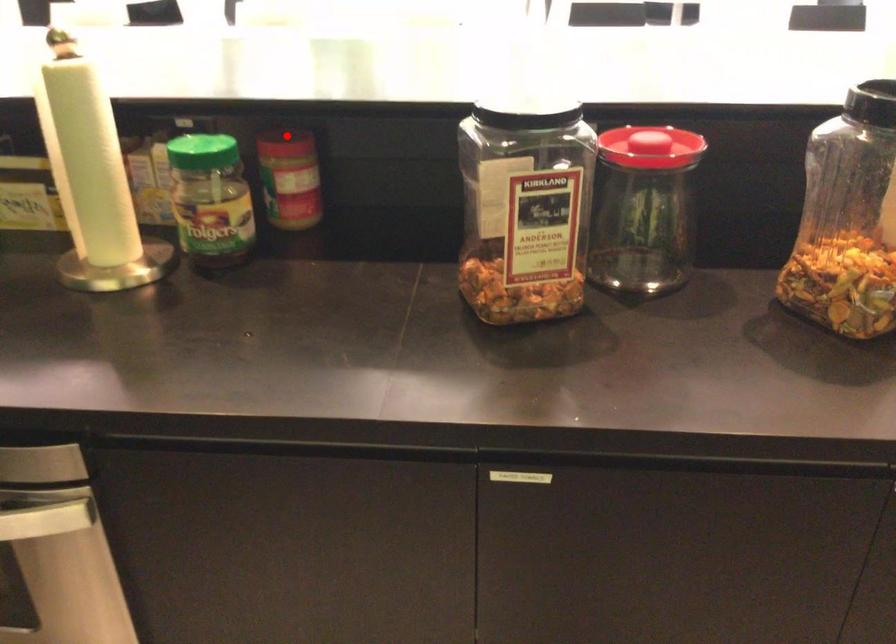
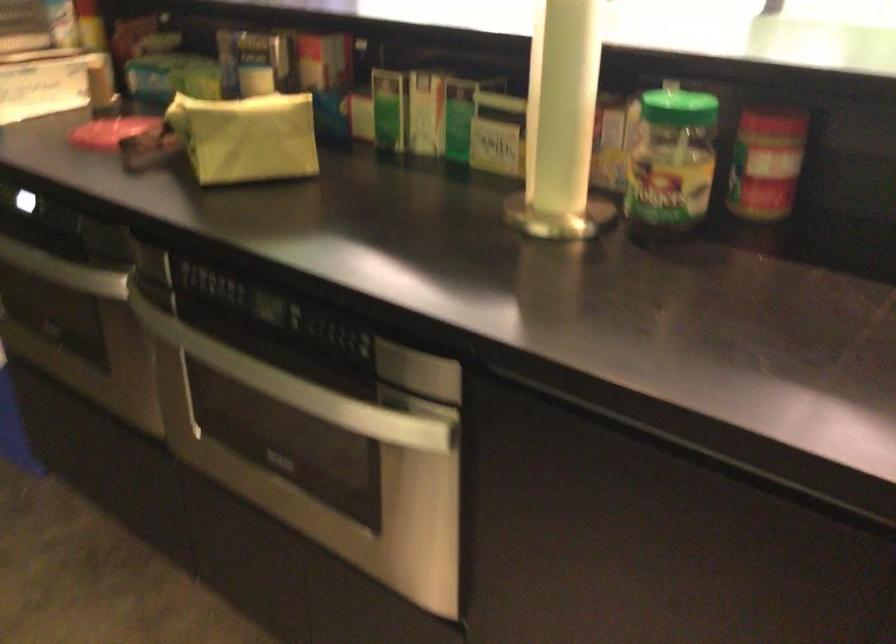
Where in the second image is the point corresponding to the highlighted location from the first image?

(773, 116)